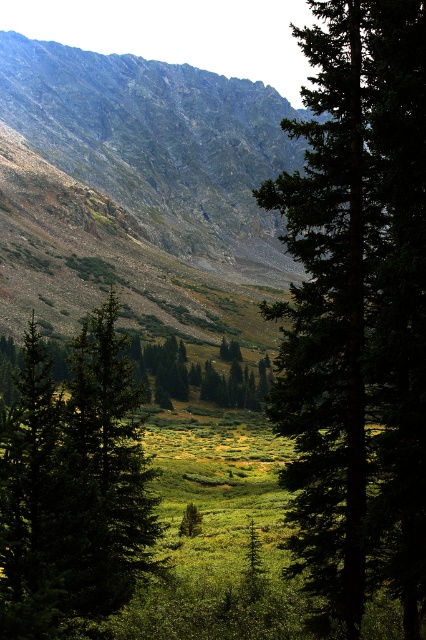
Is green matte tree at center wider than rugged stone mountain at upper left?

Result: In fact, green matte tree at center might be narrower than rugged stone mountain at upper left.

Is green matte tree at center thinner than rugged stone mountain at upper left?

Correct, green matte tree at center's width is less than rugged stone mountain at upper left's.

Find the location of a particular element. The image size is (426, 640). green matte tree at center is located at coordinates (357, 308).

Is rugged stone mountain at upper left bigger than green textured tree at center?

Indeed, rugged stone mountain at upper left has a larger size compared to green textured tree at center.

Is rugged stone mountain at upper left positioned before green textured tree at center?

That is False.

Between point (63, 168) and point (115, 506), which one is positioned behind?

The point (63, 168) is more distant.

Where is `rugged stone mountain at upper left`? rugged stone mountain at upper left is located at coordinates (161, 147).

Can you confirm if green matte tree at center is taller than green textured tree at center?

A: Correct, green matte tree at center is much taller as green textured tree at center.

Does green matte tree at center lie behind green textured tree at center?

Yes, it is.

Which is behind, point (328, 381) or point (43, 422)?

Positioned behind is point (328, 381).

I want to click on green matte tree at center, so click(357, 308).